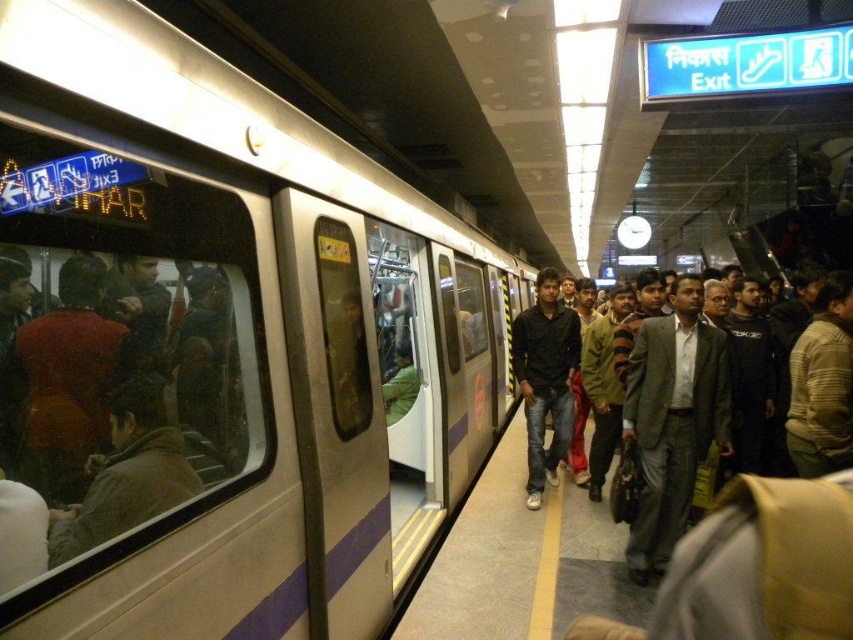
Question: Which point is farther from the camera taking this photo?

Choices:
 (A) (242, 452)
 (B) (521, 385)

Answer: (B)

Question: Is the position of brown leather jacket at left less distant than that of black matte shirt at center?

Choices:
 (A) yes
 (B) no

Answer: (A)

Question: Which of the following is the farthest from the observer?

Choices:
 (A) black matte shirt at center
 (B) dark gray suit at center

Answer: (A)

Question: Is brown leather jacket at left behind black matte shirt at center?

Choices:
 (A) no
 (B) yes

Answer: (A)

Question: Does dark gray suit at center appear over black matte shirt at center?

Choices:
 (A) no
 (B) yes

Answer: (A)

Question: Estimate the real-world distances between objects in this image. Which object is farther from the gray suit at center?

Choices:
 (A) brown leather jacket at left
 (B) black matte shirt at center

Answer: (A)